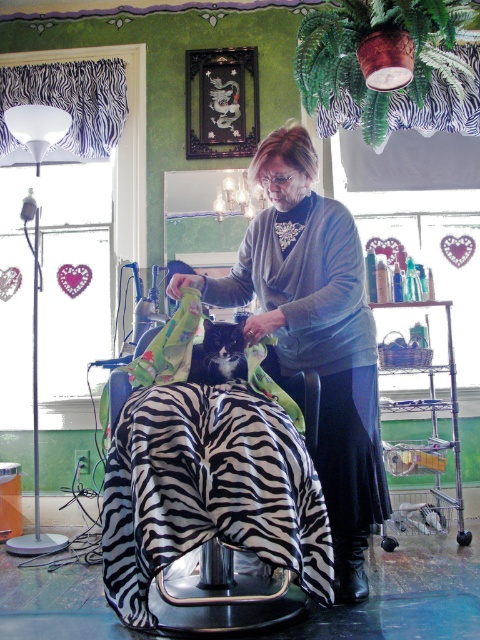
Which is behind, point (344, 456) or point (204, 340)?

Positioned behind is point (344, 456).

Can you confirm if matte gray sweater at center is bigger than black fur cat at center?

Yes.

Between point (314, 458) and point (238, 337), which one is positioned behind?

Point (314, 458)

Locate an element on the screen. The width and height of the screenshot is (480, 640). matte gray sweater at center is located at coordinates (314, 333).